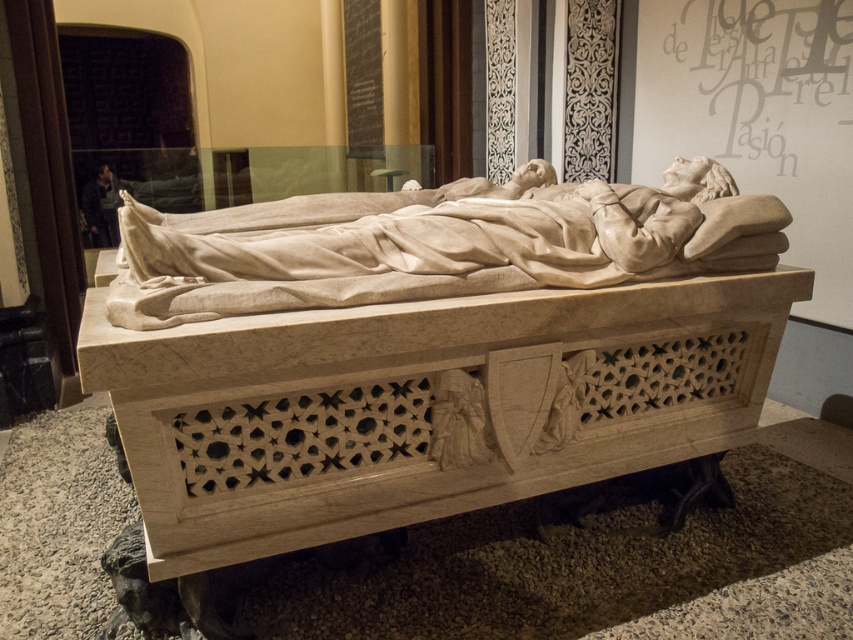
Question: Is white marble sarcophagus at center below matte gray text at upper center?

Choices:
 (A) no
 (B) yes

Answer: (B)

Question: Can you confirm if white marble sarcophagus at center is positioned to the left of white marble statue at center?

Choices:
 (A) no
 (B) yes

Answer: (A)

Question: Which point is closer to the camera?

Choices:
 (A) white marble statue at center
 (B) matte gray text at upper center

Answer: (A)

Question: Does white marble sarcophagus at center appear over matte gray text at upper center?

Choices:
 (A) yes
 (B) no

Answer: (B)

Question: Which point is farther to the camera?

Choices:
 (A) white marble sarcophagus at center
 (B) white marble statue at center

Answer: (B)

Question: Which is farther from the matte gray text at upper center?

Choices:
 (A) white marble sarcophagus at center
 (B) white marble statue at center

Answer: (A)